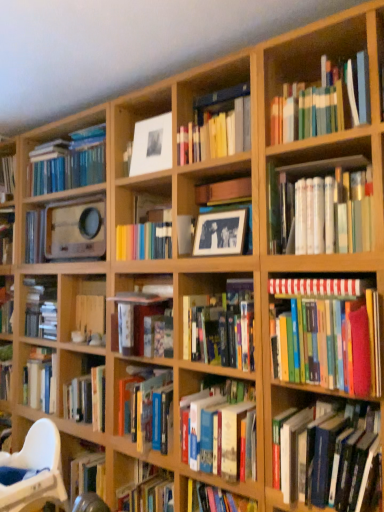
Question: Based on their sizes in the image, would you say white matte picture frame at upper center is bigger or smaller than hardcover books at center, acting as the 8th book starting from the top?

Choices:
 (A) big
 (B) small

Answer: (B)

Question: From the image's perspective, is white matte picture frame at upper center positioned above or below hardcover books at center, acting as the 1th book starting from the bottom?

Choices:
 (A) above
 (B) below

Answer: (A)

Question: Estimate the real-world distances between objects in this image. Which object is closer to the hardcover books at right, arranged as the fourth book when viewed from the top?

Choices:
 (A) white matte picture frame at upper center
 (B) hardcover books at lower right, which is the second book in bottom-to-top order
 (C) white striped book at upper right, positioned as the sixth book in bottom-to-top order
 (D) matte black picture frame at center
 (E) hardcover book at center, the 6th book positioned from the top

Answer: (C)

Question: Estimate the real-world distances between objects in this image. Which object is closer to the hardcover books at center, which is the 5th book in top-to-bottom order?

Choices:
 (A) white plastic chair at lower left
 (B) hardcover books at center, acting as the 1th book starting from the bottom
 (C) hardcover books at right, positioned as the 5th book in bottom-to-top order
 (D) white striped book at upper right, positioned as the sixth book in bottom-to-top order
 (E) hardcover books at lower right, the seventh book positioned from the top

Answer: (B)